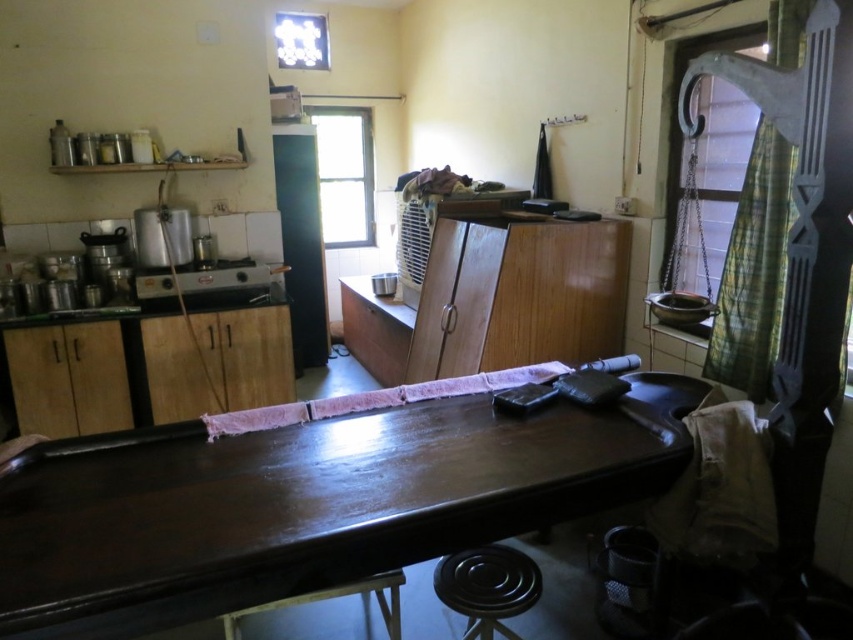
You are standing at the origin point of the room. Where is the glossy wood table at center located in terms of coordinates?

The glossy wood table at center is located at coordinates point (305, 508).

You are standing at the entrance of the room and need to locate the metallic silver toaster at left. According to the coordinates given, where should you look to find it?

The metallic silver toaster at left is located at coordinates point (x=206, y=280).